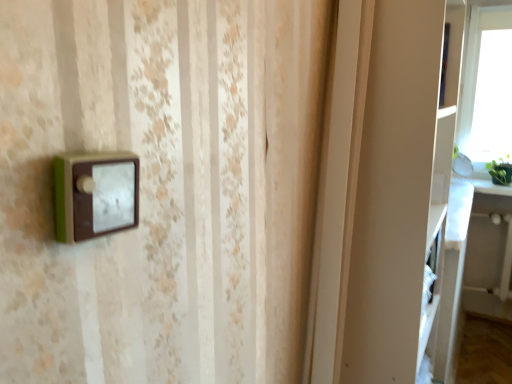
Question: Does white glossy table at right turn towards white matte cabinet at right?

Choices:
 (A) no
 (B) yes

Answer: (B)

Question: Are white glossy table at right and white matte cabinet at right located far from each other?

Choices:
 (A) no
 (B) yes

Answer: (B)

Question: Considering the relative positions of white glossy table at right and white matte cabinet at right in the image provided, is white glossy table at right to the right of white matte cabinet at right from the viewer's perspective?

Choices:
 (A) yes
 (B) no

Answer: (A)

Question: From the image's perspective, is white glossy table at right located above white matte cabinet at right?

Choices:
 (A) yes
 (B) no

Answer: (B)

Question: From a real-world perspective, is white glossy table at right on white matte cabinet at right?

Choices:
 (A) yes
 (B) no

Answer: (B)

Question: Is white glossy table at right looking in the opposite direction of white matte cabinet at right?

Choices:
 (A) yes
 (B) no

Answer: (B)

Question: Considering the relative sizes of white matte cabinet at right and white glossy table at right in the image provided, is white matte cabinet at right bigger than white glossy table at right?

Choices:
 (A) yes
 (B) no

Answer: (A)

Question: From the image's perspective, would you say white matte cabinet at right is shown under white glossy table at right?

Choices:
 (A) yes
 (B) no

Answer: (B)

Question: Can you confirm if white matte cabinet at right is shorter than white glossy table at right?

Choices:
 (A) yes
 (B) no

Answer: (B)

Question: Does white matte cabinet at right have a greater width compared to white glossy table at right?

Choices:
 (A) yes
 (B) no

Answer: (A)

Question: Is white matte cabinet at right in front of white glossy table at right?

Choices:
 (A) yes
 (B) no

Answer: (A)

Question: Is white matte cabinet at right outside white glossy table at right?

Choices:
 (A) yes
 (B) no

Answer: (A)

Question: In terms of size, does white matte cabinet at right appear bigger or smaller than white glossy table at right?

Choices:
 (A) small
 (B) big

Answer: (B)